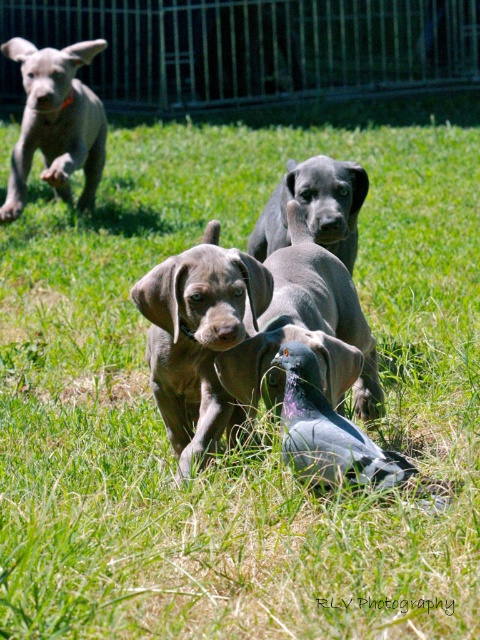
You are a photographer trying to capture the smooth gray dog at center in the image. Based on its position coordinates, where should you aim your camera to ensure it is centered in your shot?

The smooth gray dog at center is located at point [305,330], so you should aim your camera at those coordinates to center it in your shot.

You are a photographer trying to capture a clear shot of the shiny black puppy at center without the gray matte pigeon at center blocking it. How should you adjust your camera position?

The gray matte pigeon at center is positioned under the shiny black puppy at center, so you should move your camera position slightly upward to avoid the pigeon blocking the view of the puppy.